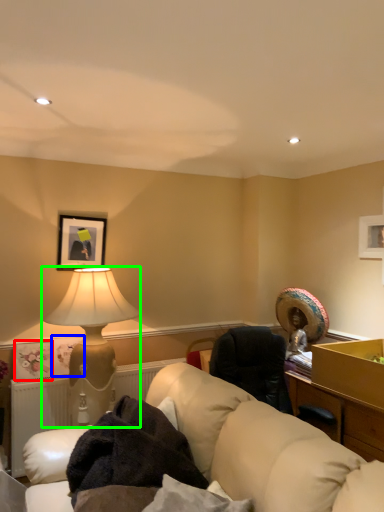
Question: Which object is the farthest from picture frame (highlighted by a red box)? Choose among these: picture frame (highlighted by a blue box) or lamp (highlighted by a green box).

Choices:
 (A) picture frame
 (B) lamp

Answer: (B)